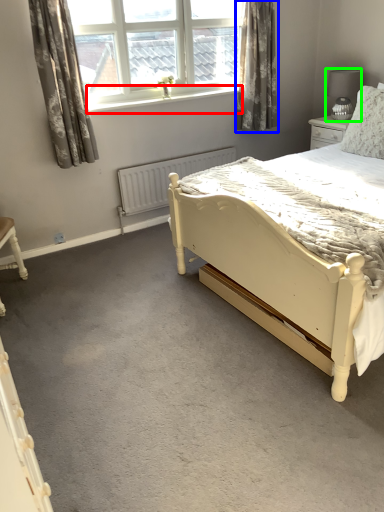
Question: Considering the real-world distances, which object is farthest from window sill (highlighted by a red box)? curtain (highlighted by a blue box) or lamp (highlighted by a green box)?

Choices:
 (A) curtain
 (B) lamp

Answer: (B)